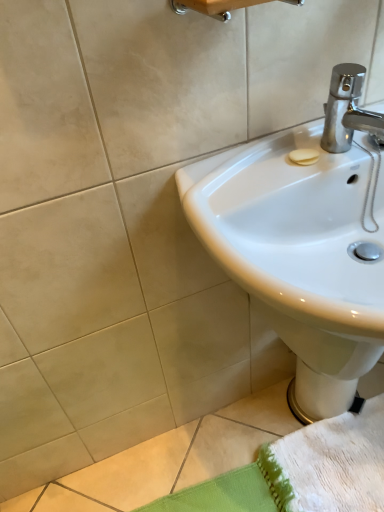
Find the location of `free region on the left part of white glossy bidet at lower right`. free region on the left part of white glossy bidet at lower right is located at coordinates (262, 420).